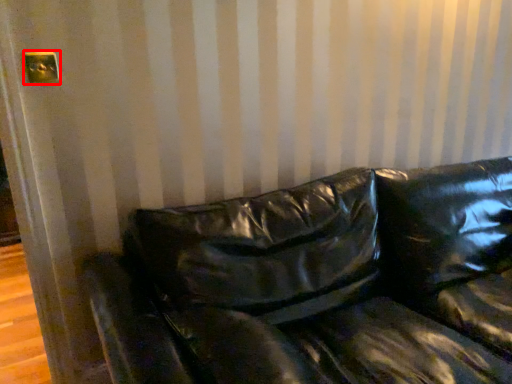
Question: In this image, where is electric outlet (annotated by the red box) located relative to studio couch?

Choices:
 (A) right
 (B) left

Answer: (B)